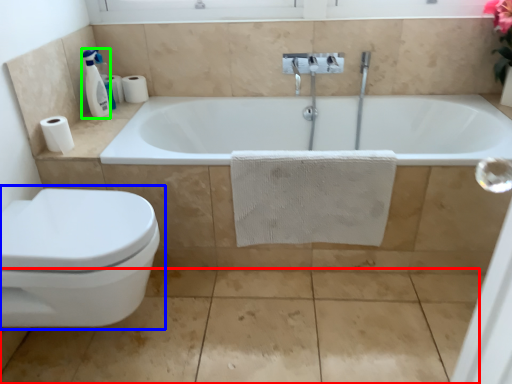
Question: Based on their relative distances, which object is farther from concrete (highlighted by a red box)? Choose from toilet (highlighted by a blue box) and soap dispenser (highlighted by a green box).

Choices:
 (A) toilet
 (B) soap dispenser

Answer: (B)